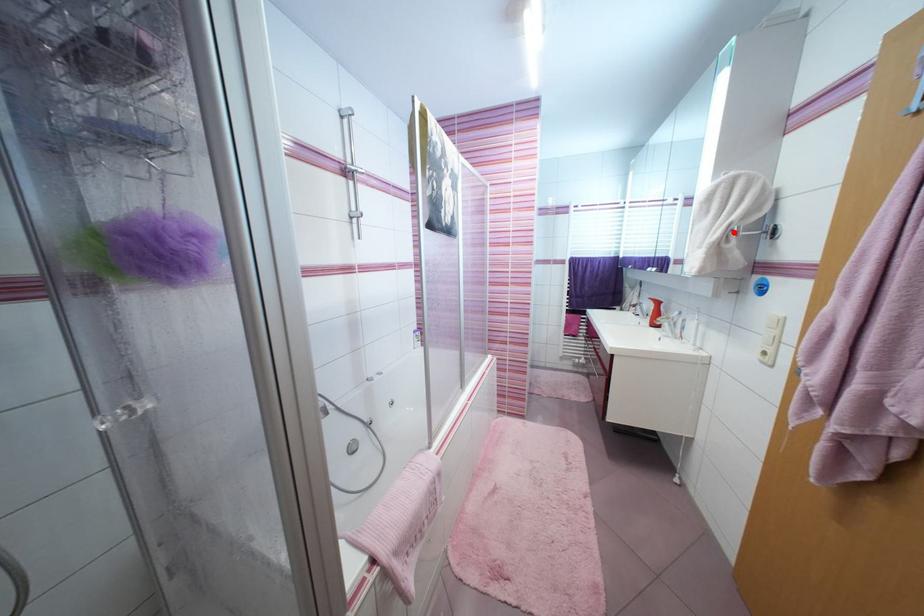
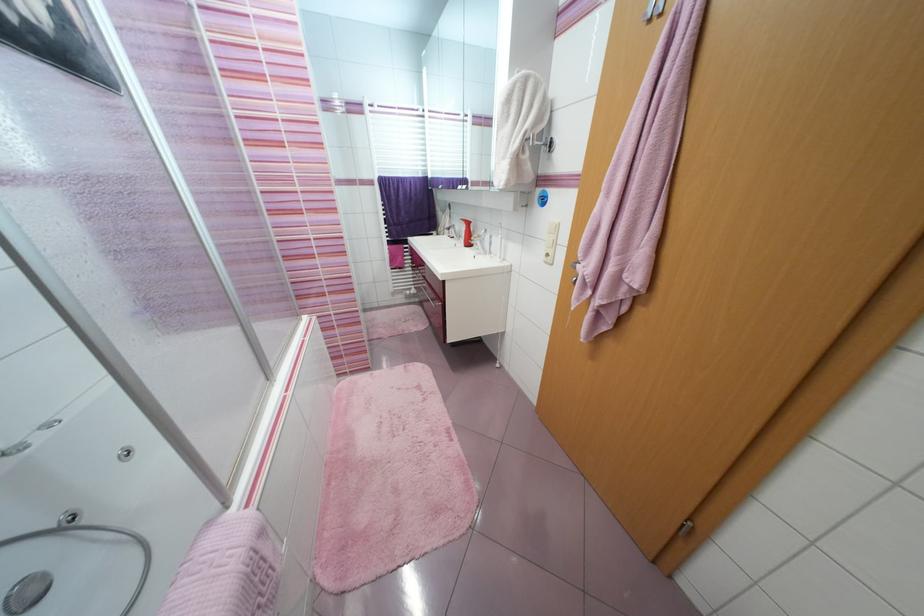
Locate, in the second image, the point that corresponds to the highlighted location in the first image.

(530, 140)